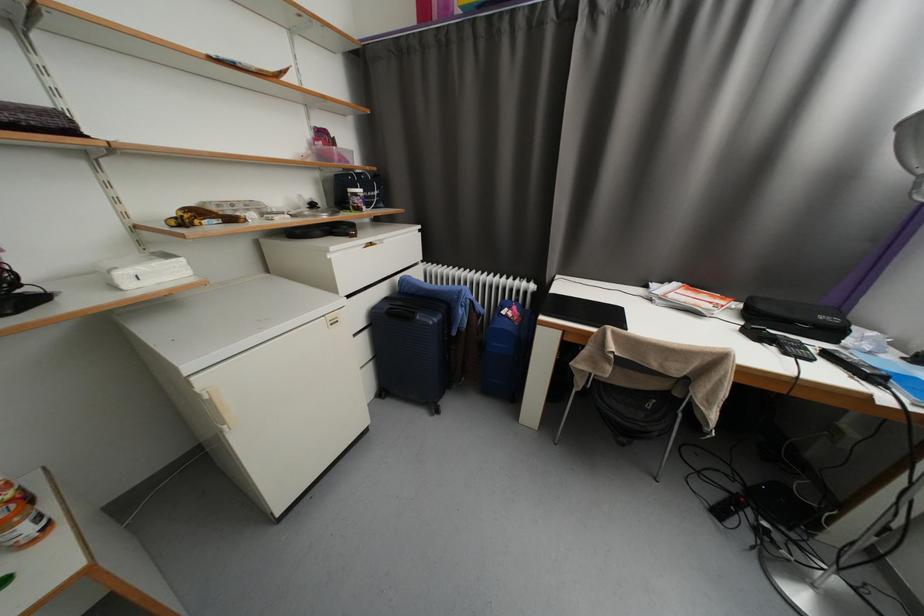
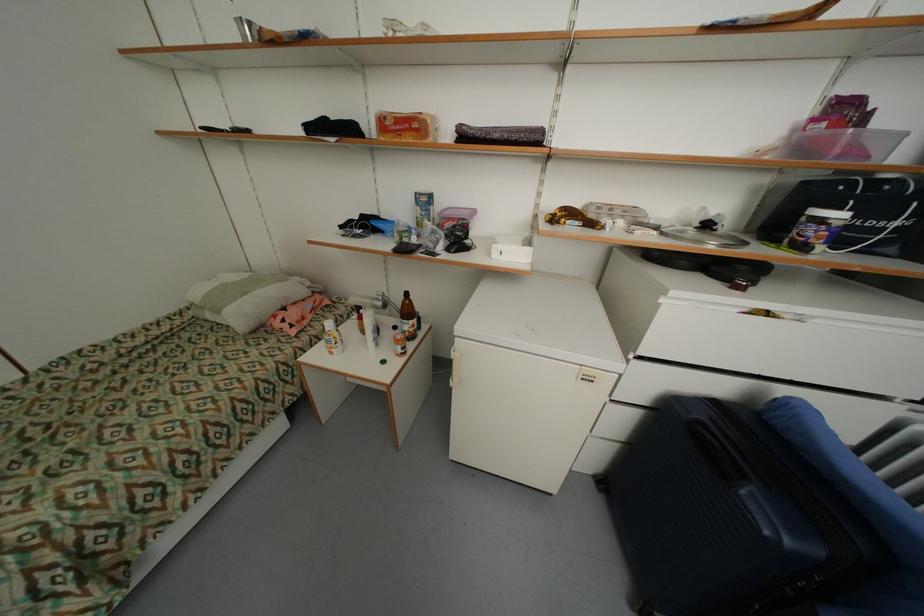
The point at (320, 207) is marked in the first image. Where is the corresponding point in the second image?

(713, 227)